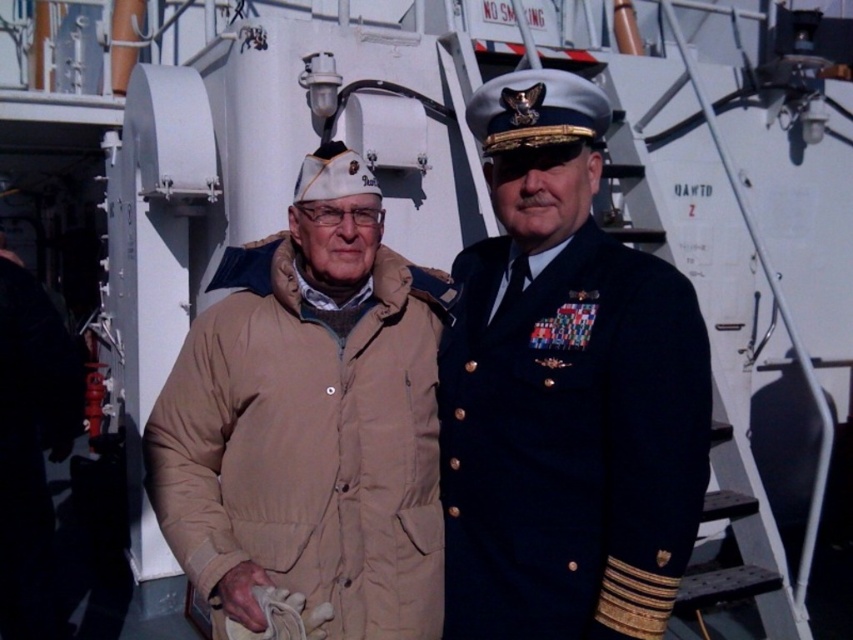
You are a photographer taking a picture of two people wearing jackets. You need to ensure both jackets are clearly visible in the photo. Since the tan fabric jacket at center and the tan quilted jacket at center are both at center, which jacket might be partially hidden and require adjusting the camera angle?

The tan quilted jacket at center might be partially hidden because the tan fabric jacket at center is closer to the viewer, so adjusting the camera angle to capture both jackets fully would be necessary.

You are a photographer standing at the camera position. You want to take a photo of the tan fabric jacket at center. Can you reach it with your 1.5 meter long extendable pole?

The tan fabric jacket at center and camera are 1.82 meters apart. Since the extendable pole is only 1.5 meters long, you cannot reach the tan fabric jacket at center with it.